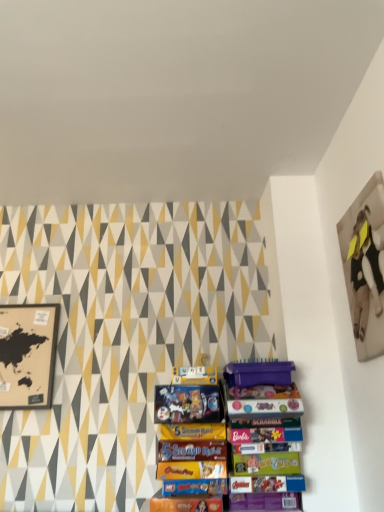
Question: Is matte black picture frame at upper right, placed as the second picture frame when sorted from left to right, to the right of matte black map at left, the first picture frame in the bottom-to-top sequence, from the viewer's perspective?

Choices:
 (A) no
 (B) yes

Answer: (B)

Question: Can matte black map at left, which is the 1th picture frame in left-to-right order, be found inside matte black picture frame at upper right, marked as the 2th picture frame in a back-to-front arrangement?

Choices:
 (A) yes
 (B) no

Answer: (B)

Question: Considering the relative sizes of matte black picture frame at upper right, acting as the 1th picture frame starting from the top, and matte black map at left, positioned as the first picture frame in back-to-front order, in the image provided, is matte black picture frame at upper right, acting as the 1th picture frame starting from the top, thinner than matte black map at left, positioned as the first picture frame in back-to-front order,?

Choices:
 (A) no
 (B) yes

Answer: (B)

Question: Is matte black picture frame at upper right, marked as the 2th picture frame in a back-to-front arrangement, positioned behind matte black map at left, acting as the second picture frame starting from the top?

Choices:
 (A) no
 (B) yes

Answer: (A)

Question: Considering the relative positions of matte black picture frame at upper right, the 1th picture frame from the right, and matte black map at left, the first picture frame in the bottom-to-top sequence, in the image provided, is matte black picture frame at upper right, the 1th picture frame from the right, in front of matte black map at left, the first picture frame in the bottom-to-top sequence,?

Choices:
 (A) yes
 (B) no

Answer: (A)

Question: Is matte black picture frame at upper right, marked as the 2th picture frame in a bottom-to-top arrangement, to the left of matte black map at left, which is the 1th picture frame in left-to-right order, from the viewer's perspective?

Choices:
 (A) no
 (B) yes

Answer: (A)

Question: Is matte black map at left, the first picture frame in the bottom-to-top sequence, not within matte black picture frame at upper right, acting as the 1th picture frame starting from the top?

Choices:
 (A) no
 (B) yes

Answer: (B)

Question: Considering the relative positions of matte black map at left, the 2th picture frame in the front-to-back sequence, and matte black picture frame at upper right, marked as the 2th picture frame in a bottom-to-top arrangement, in the image provided, is matte black map at left, the 2th picture frame in the front-to-back sequence, behind matte black picture frame at upper right, marked as the 2th picture frame in a bottom-to-top arrangement,?

Choices:
 (A) no
 (B) yes

Answer: (B)

Question: Is matte black map at left, acting as the second picture frame starting from the top, turned away from matte black picture frame at upper right, the 1th picture frame from the right?

Choices:
 (A) no
 (B) yes

Answer: (A)

Question: Considering the relative sizes of matte black map at left, the 2th picture frame in the front-to-back sequence, and matte black picture frame at upper right, the 1th picture frame from the right, in the image provided, is matte black map at left, the 2th picture frame in the front-to-back sequence, thinner than matte black picture frame at upper right, the 1th picture frame from the right,?

Choices:
 (A) no
 (B) yes

Answer: (A)

Question: Is matte black map at left, which is the 1th picture frame in left-to-right order, wider than matte black picture frame at upper right, the 1th picture frame from the right?

Choices:
 (A) no
 (B) yes

Answer: (B)

Question: From a real-world perspective, is matte black map at left, acting as the second picture frame starting from the top, below matte black picture frame at upper right, acting as the 1th picture frame starting from the top?

Choices:
 (A) yes
 (B) no

Answer: (A)

Question: In the image, is matte black map at left, the 2th picture frame in the front-to-back sequence, on the left side or the right side of matte black picture frame at upper right, marked as the 2th picture frame in a bottom-to-top arrangement?

Choices:
 (A) right
 (B) left

Answer: (B)